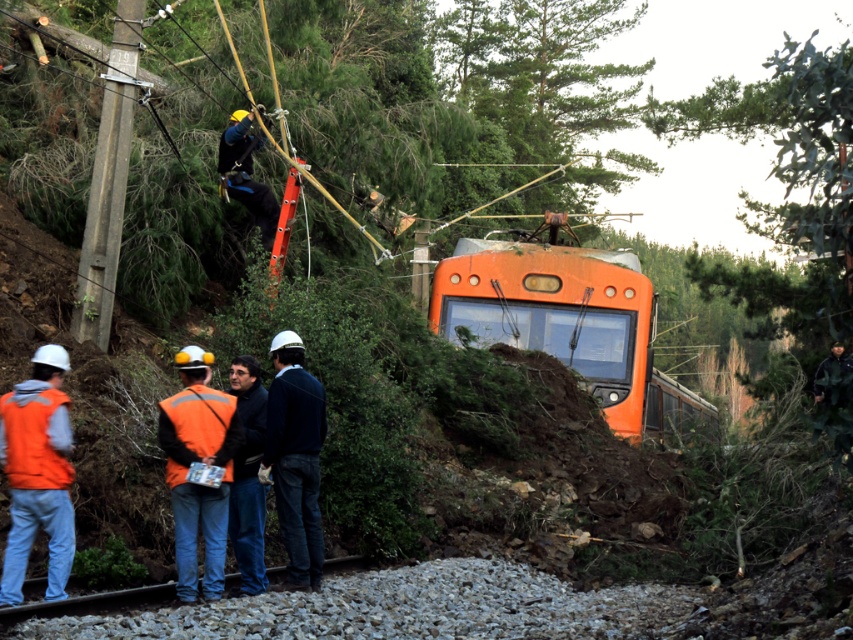
You are a railway inspector standing at point A, which is at the bottom of the slope where the landslide occurred. You need to reach the orange train at center to assess the damage. However, there is an obstacle at point B located at point [294,458]. What is the safest path to take to avoid the obstacle and reach the orange train at center?

The safest path would be to go around the obstacle at point B, which is located at [294,458], by moving either to the left or right of it while staying clear of the landslide area. This ensures you avoid the dark blue jeans at center and reach the orange train at center safely.

You are a worker at the scene and need to retrieve a tool from the ground near the orange reflective vest at lower left. As you move towards it, will you pass by the dark blue jeans at center first or reach the vest first?

The orange reflective vest at lower left is closer to the viewer than the dark blue jeans at center, so you will reach the vest first without passing by the jeans.